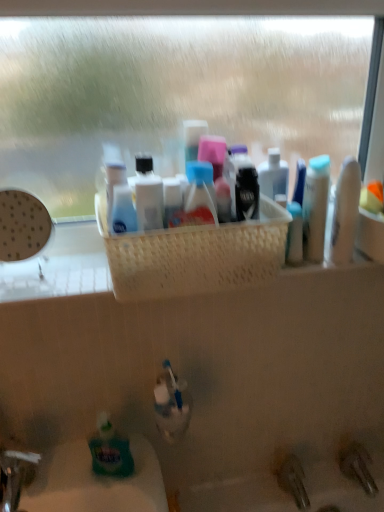
Measure the distance between green matte bottle at lower left and camera.

33.76 inches.

The image size is (384, 512). What do you see at coordinates (110, 450) in the screenshot?
I see `green matte bottle at lower left` at bounding box center [110, 450].

This screenshot has width=384, height=512. Find the location of `green matte bottle at lower left`. green matte bottle at lower left is located at coordinates (110, 450).

The image size is (384, 512). Identify the location of green matte bottle at lower left. (110, 450).